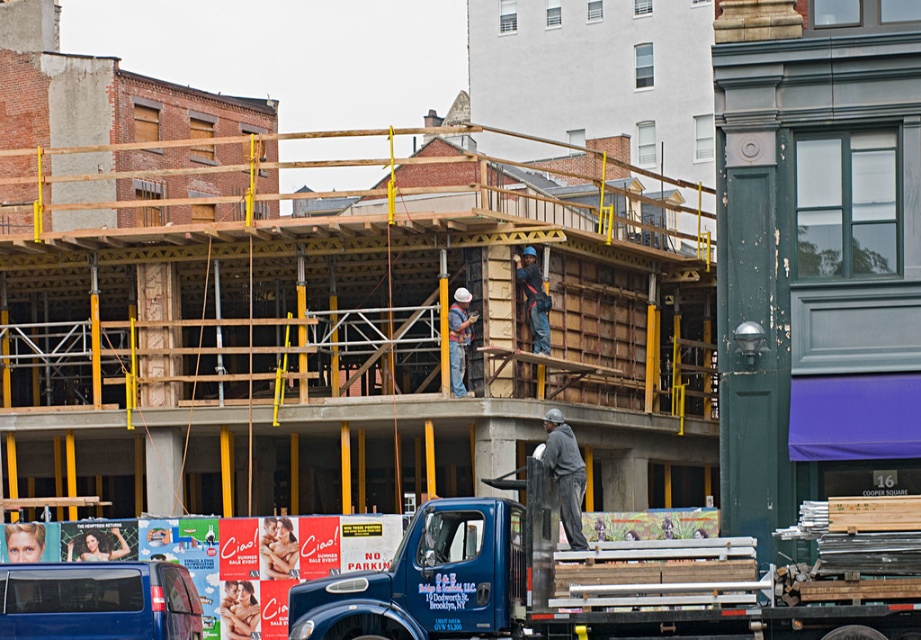
Can you confirm if blue metallic truck at center is wider than blue matte truck at center?

Incorrect, blue metallic truck at center's width does not surpass blue matte truck at center's.

The image size is (921, 640). I want to click on blue metallic truck at center, so click(601, 582).

Locate an element on the screen. This screenshot has width=921, height=640. blue metallic truck at center is located at coordinates (601, 582).

Can you confirm if dark gray fabric jacket at center is smaller than matte gray hard hat at center?

No.

Who is lower down, dark gray fabric jacket at center or matte gray hard hat at center?

Positioned lower is dark gray fabric jacket at center.

Who is more distant from viewer, (572, 444) or (464, 342)?

Positioned behind is point (464, 342).

At what (x,y) coordinates should I click in order to perform the action: click on dark gray fabric jacket at center. Please return your answer as a coordinate pair (x, y). This screenshot has width=921, height=640. Looking at the image, I should click on (565, 474).

How much distance is there between blue metallic truck at center and dark gray fabric jacket at center?

blue metallic truck at center is 4.33 meters away from dark gray fabric jacket at center.

Is blue metallic truck at center above dark gray fabric jacket at center?

Incorrect, blue metallic truck at center is not positioned above dark gray fabric jacket at center.

In order to click on blue metallic truck at center in this screenshot , I will do `click(601, 582)`.